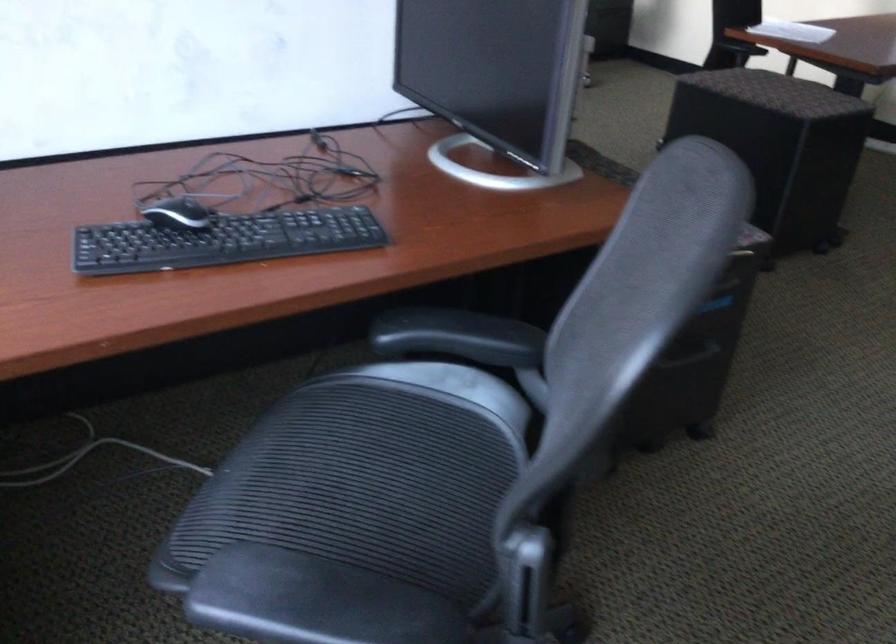
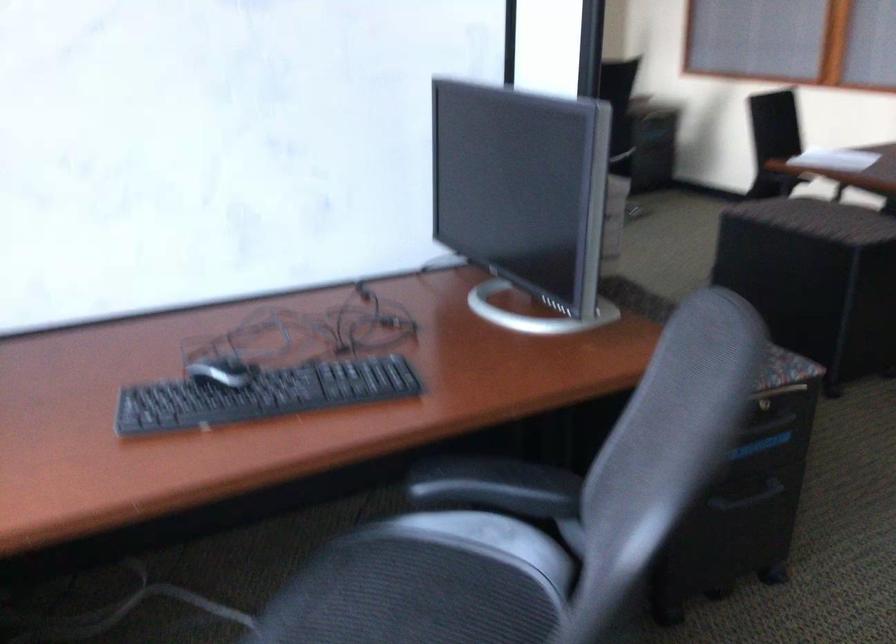
Locate, in the second image, the point that corresponds to (459,335) in the first image.

(495, 486)